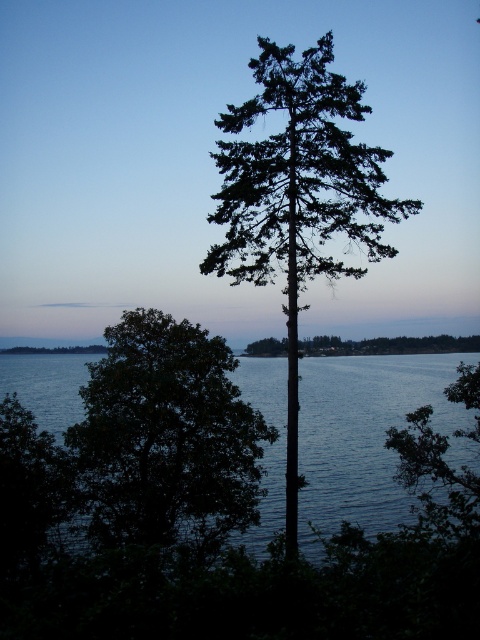
You are standing at the point marked by the coordinates point (167, 440) in the image. Looking around, you see the green leafy tree at center and the smaller tree in the midground. Which tree is closer to your current position?

The green leafy tree at center is closer to your current position marked by point (167, 440) because the point marks its location.